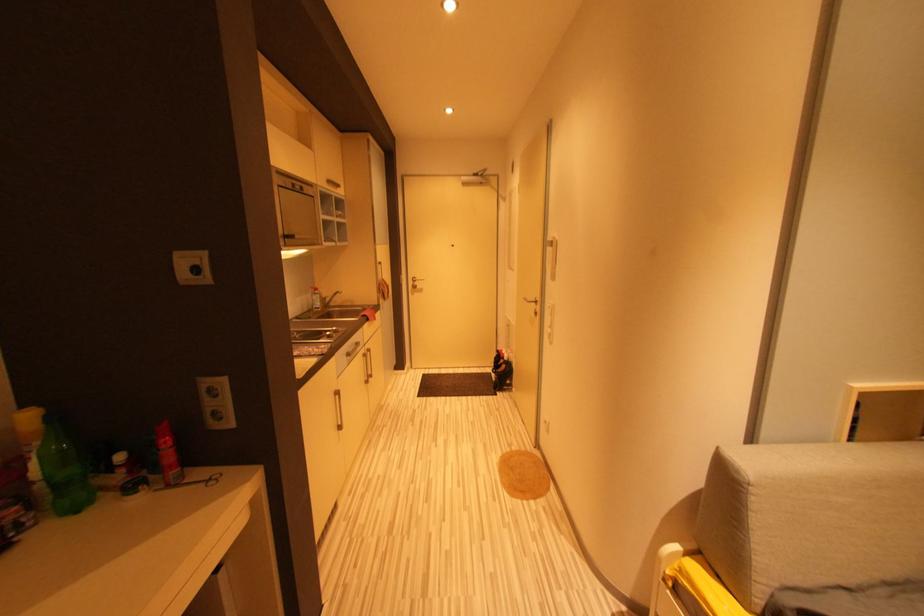
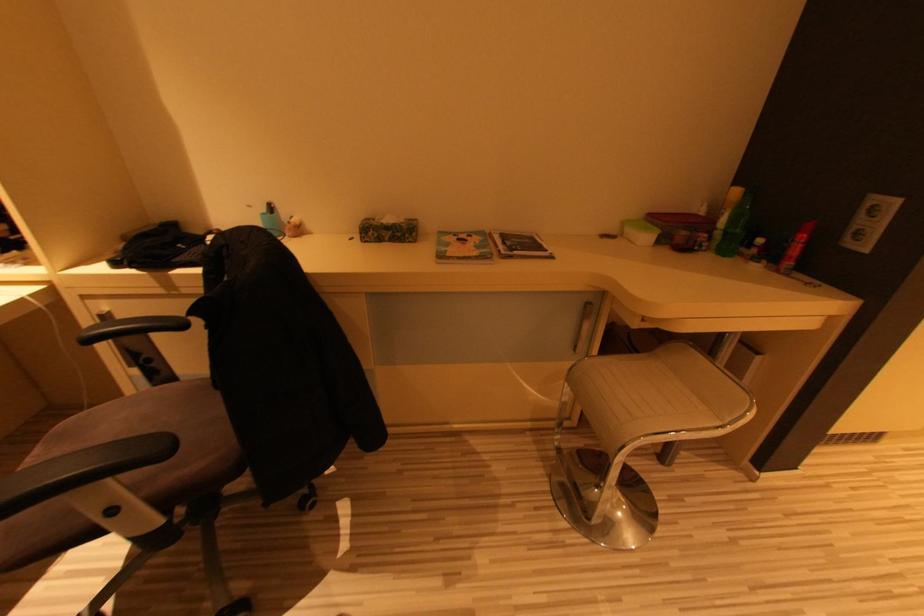
First-person continuous shooting, in which direction is the camera rotating?

The camera's rotation is toward left-down.